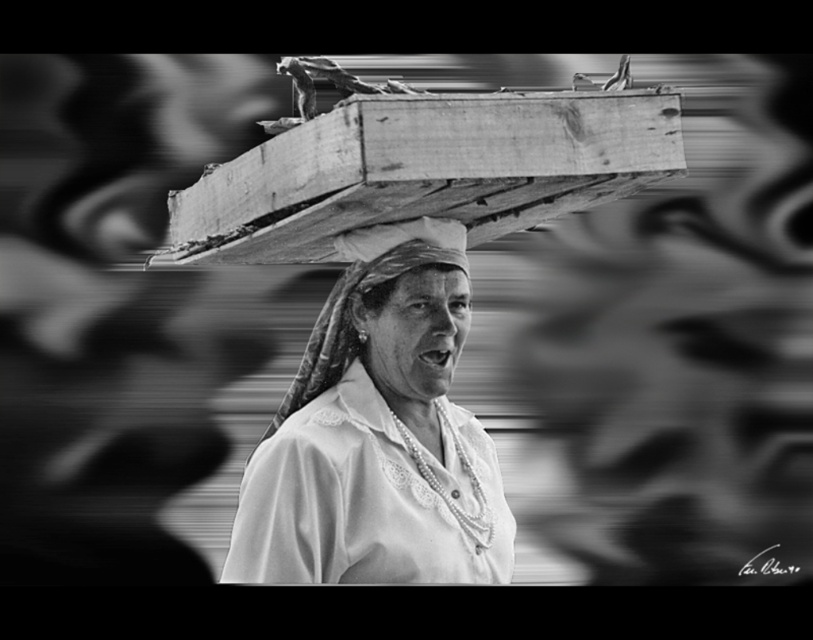
Question: Does white lace shirt at center come in front of smooth fabric headscarf at center?

Choices:
 (A) yes
 (B) no

Answer: (A)

Question: Among these objects, which one is farthest from the camera?

Choices:
 (A) white lace shirt at center
 (B) smooth fabric headscarf at center

Answer: (B)

Question: Among these points, which one is nearest to the camera?

Choices:
 (A) (450, 227)
 (B) (302, 401)

Answer: (A)

Question: Is white lace shirt at center to the left of smooth fabric headscarf at center from the viewer's perspective?

Choices:
 (A) no
 (B) yes

Answer: (B)

Question: Does white lace shirt at center have a larger size compared to smooth fabric headscarf at center?

Choices:
 (A) no
 (B) yes

Answer: (B)